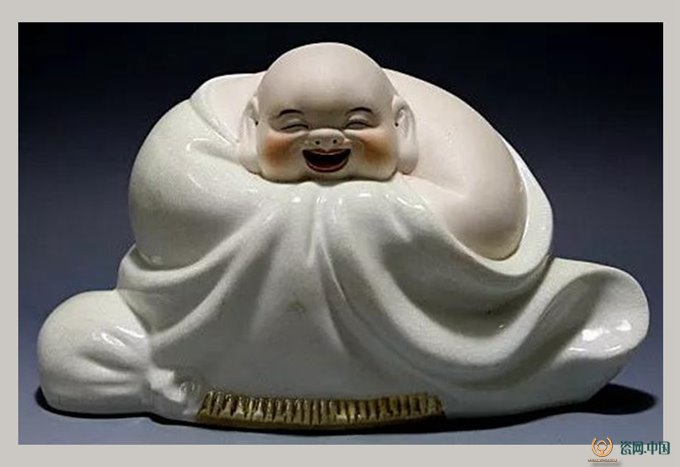
Locate an element on the screen. This screenshot has width=680, height=467. white robe is located at coordinates (322, 271).